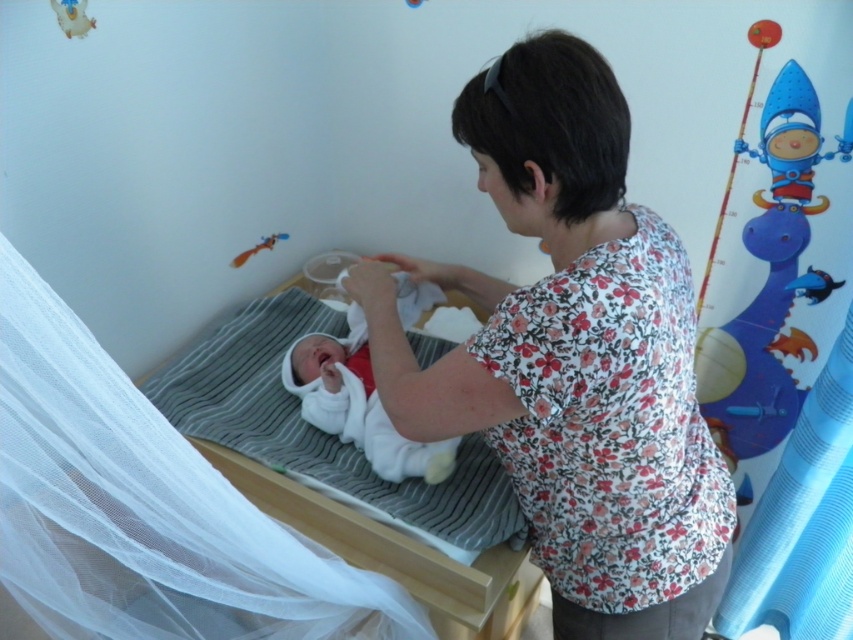
Between white striped fabric at center and matte orange toy at upper left, which one appears on the left side from the viewer's perspective?

From the viewer's perspective, matte orange toy at upper left appears more on the left side.

Does white striped fabric at center have a greater height compared to matte orange toy at upper left?

Correct, white striped fabric at center is much taller as matte orange toy at upper left.

Locate an element on the screen. The width and height of the screenshot is (853, 640). white striped fabric at center is located at coordinates (387, 547).

Locate an element on the screen. This screenshot has height=640, width=853. white striped fabric at center is located at coordinates (387, 547).

Does blue fabric rocket at upper right have a greater height compared to matte orange toy at upper left?

Indeed, blue fabric rocket at upper right has a greater height compared to matte orange toy at upper left.

Locate an element on the screen. Image resolution: width=853 pixels, height=640 pixels. blue fabric rocket at upper right is located at coordinates (793, 140).

Identify the location of blue fabric rocket at upper right. This screenshot has height=640, width=853. (793, 140).

Can you confirm if white soft baby at center is wider than blue fabric rocket at upper right?

Yes, white soft baby at center is wider than blue fabric rocket at upper right.

Can you confirm if white soft baby at center is positioned to the right of blue fabric rocket at upper right?

No, white soft baby at center is not to the right of blue fabric rocket at upper right.

Is point (341, 349) closer to viewer compared to point (775, 88)?

No, it is behind (775, 88).

The width and height of the screenshot is (853, 640). I want to click on white soft baby at center, so [357, 403].